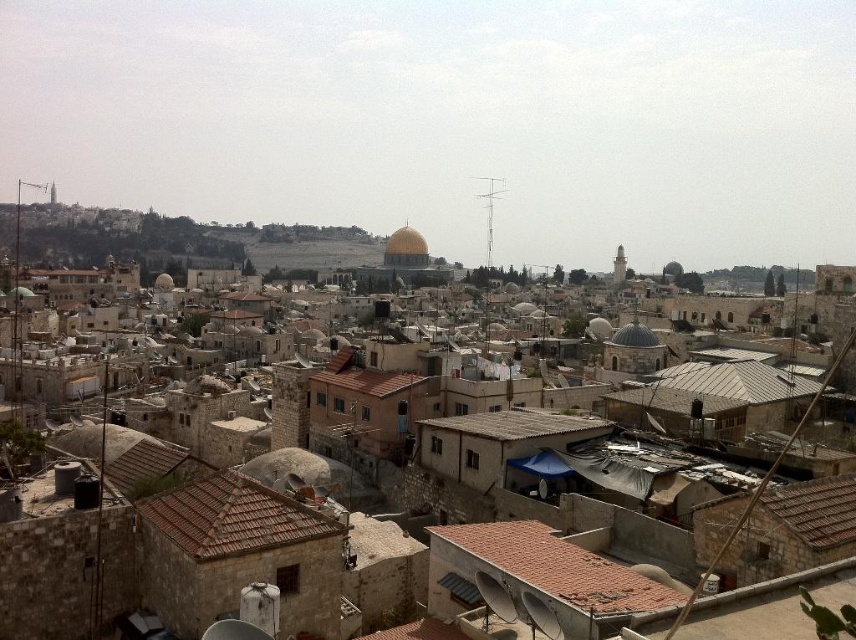
Question: Is brown tile roof at lower left further to the viewer compared to brown tile roof at center?

Choices:
 (A) no
 (B) yes

Answer: (A)

Question: Does brown tile roof at lower left lie behind golden stone dome at center?

Choices:
 (A) no
 (B) yes

Answer: (A)

Question: Is the position of brown textured roof at center more distant than that of golden stone dome at center?

Choices:
 (A) yes
 (B) no

Answer: (B)

Question: Which object is positioned closest to the brown tile roof at center?

Choices:
 (A) brown textured roof at center
 (B) brown tile roof at lower left
 (C) brown tiled roof at lower center
 (D) golden stone dome at center

Answer: (A)

Question: Among these points, which one is farthest from the camera?

Choices:
 (A) (418, 236)
 (B) (278, 556)
 (C) (260, 496)

Answer: (A)

Question: Which of these objects is positioned closest to the brown tile roof at center?

Choices:
 (A) brown tile roof at lower left
 (B) brown tiled roof at lower center

Answer: (A)